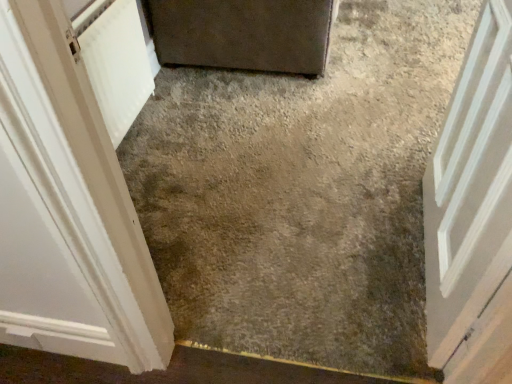
This screenshot has height=384, width=512. Describe the element at coordinates (302, 192) in the screenshot. I see `gray concrete at center` at that location.

Measure the distance between matte gray door at upper center, the 2th door positioned from the right, and camera.

The depth of matte gray door at upper center, the 2th door positioned from the right, is 2.22 meters.

What is the approximate width of white painted wood door at left, the 3th door positioned from the right?

6.00 inches.

What are the coordinates of `gray concrete at center` in the screenshot? It's located at (302, 192).

Between gray concrete at center and matte gray door at upper center, the 2th door positioned from the right, which one has less height?

Standing shorter between the two is gray concrete at center.

Is gray concrete at center inside the boundaries of matte gray door at upper center, the 2th door positioned from the right, or outside?

gray concrete at center lies outside matte gray door at upper center, the 2th door positioned from the right.

Is gray concrete at center far away from matte gray door at upper center, which is the 2th door in left-to-right order?

No, gray concrete at center is in close proximity to matte gray door at upper center, which is the 2th door in left-to-right order.

From the picture: Which of these two, white painted wood door at left, the 3th door positioned from the right, or white painted wood door at center, which ranks as the 1th door in right-to-left order, stands taller?

white painted wood door at center, which ranks as the 1th door in right-to-left order, is taller.

Is white painted wood door at left, the first door in the left-to-right sequence, thinner than white painted wood door at center, which ranks as the 1th door in right-to-left order?

Yes.

Is white painted wood door at center, which ranks as the 1th door in right-to-left order, a part of white painted wood door at left, the 3th door positioned from the right?

No, white painted wood door at left, the 3th door positioned from the right, does not contain white painted wood door at center, which ranks as the 1th door in right-to-left order.

From the image's perspective, which object appears higher, white painted wood door at left, the first door in the left-to-right sequence, or white painted wood door at center, the 3th door when ordered from left to right?

white painted wood door at left, the first door in the left-to-right sequence, from the image's perspective.

Considering the sizes of objects gray concrete at center and white painted wood door at center, which ranks as the 1th door in right-to-left order, in the image provided, who is wider, gray concrete at center or white painted wood door at center, which ranks as the 1th door in right-to-left order,?

Wider between the two is gray concrete at center.

From a real-world perspective, is gray concrete at center positioned over white painted wood door at center, the 3th door when ordered from left to right, based on gravity?

Actually, gray concrete at center is physically below white painted wood door at center, the 3th door when ordered from left to right, in the real world.

Can you tell me how much gray concrete at center and white painted wood door at center, the 3th door when ordered from left to right, differ in facing direction?

gray concrete at center and white painted wood door at center, the 3th door when ordered from left to right, are facing 94.9 degrees away from each other.

Which is in front, gray concrete at center or white painted wood door at center, the 3th door when ordered from left to right?

Positioned in front is white painted wood door at center, the 3th door when ordered from left to right.

From a real-world perspective, is white painted wood door at left, the first door in the left-to-right sequence, located higher than matte gray door at upper center, which is the 2th door in left-to-right order?

Yes.

Is white painted wood door at left, the first door in the left-to-right sequence, facing away from matte gray door at upper center, which is the 2th door in left-to-right order?

No, white painted wood door at left, the first door in the left-to-right sequence, is not facing the opposite direction of matte gray door at upper center, which is the 2th door in left-to-right order.

Is white painted wood door at left, the 3th door positioned from the right, with matte gray door at upper center, which is the 2th door in left-to-right order?

No, white painted wood door at left, the 3th door positioned from the right, is not making contact with matte gray door at upper center, which is the 2th door in left-to-right order.

How different are the orientations of gray concrete at center and white painted wood door at left, the first door in the left-to-right sequence, in degrees?

They differ by 90.7 degrees in their facing directions.

Is gray concrete at center wider or thinner than white painted wood door at left, the 3th door positioned from the right?

gray concrete at center is wider than white painted wood door at left, the 3th door positioned from the right.

Between gray concrete at center and white painted wood door at left, the first door in the left-to-right sequence, which one has larger size?

With larger size is gray concrete at center.

Measure the distance from gray concrete at center to white painted wood door at left, the first door in the left-to-right sequence.

gray concrete at center is 30.66 inches from white painted wood door at left, the first door in the left-to-right sequence.

From a real-world perspective, is white painted wood door at left, the first door in the left-to-right sequence, beneath gray concrete at center?

No, from a real-world perspective, white painted wood door at left, the first door in the left-to-right sequence, is not below gray concrete at center.

Would you say white painted wood door at left, the first door in the left-to-right sequence, contains gray concrete at center?

Definitely not — gray concrete at center is not inside white painted wood door at left, the first door in the left-to-right sequence.

Are white painted wood door at left, the first door in the left-to-right sequence, and gray concrete at center far apart?

white painted wood door at left, the first door in the left-to-right sequence, is near gray concrete at center, not far away.

Locate an element on the screen. The width and height of the screenshot is (512, 384). the 1st door below the gray concrete at center (from the image's perspective) is located at coordinates (68, 208).

Does point (459, 131) come farther from viewer compared to point (96, 126)?

Yes, point (459, 131) is farther from viewer.

Which of these two, white painted wood door at center, the 3th door when ordered from left to right, or white painted wood door at left, the first door in the left-to-right sequence, is thinner?

white painted wood door at left, the first door in the left-to-right sequence, is thinner.

Is white painted wood door at center, which ranks as the 1th door in right-to-left order, in front of or behind white painted wood door at left, the 3th door positioned from the right, in the image?

Clearly, white painted wood door at center, which ranks as the 1th door in right-to-left order, is in front of white painted wood door at left, the 3th door positioned from the right.

Which is correct: white painted wood door at center, which ranks as the 1th door in right-to-left order, is inside white painted wood door at left, the first door in the left-to-right sequence, or outside of it?

white painted wood door at center, which ranks as the 1th door in right-to-left order, is not enclosed by white painted wood door at left, the first door in the left-to-right sequence.

Find the location of a particular element. The height and width of the screenshot is (384, 512). the 1st door to the left when counting from the gray concrete at center is located at coordinates (243, 34).

You are a GUI agent. You are given a task and a screenshot of the screen. Output one action in this format:
    pyautogui.click(x=<x>, y=<y>)
    Task: Click on the 1st door behind the white painted wood door at center, the 3th door when ordered from left to right, starting your count from the anchor
    The height and width of the screenshot is (384, 512).
    Given the screenshot: What is the action you would take?
    pyautogui.click(x=68, y=208)

Which object lies further to the anchor point white painted wood door at left, the first door in the left-to-right sequence, gray concrete at center or white painted wood door at center, the 3th door when ordered from left to right?

Based on the image, white painted wood door at center, the 3th door when ordered from left to right, appears to be further to white painted wood door at left, the first door in the left-to-right sequence.

Estimate the real-world distances between objects in this image. Which object is closer to white painted wood door at left, the 3th door positioned from the right, matte gray door at upper center, the 2th door positioned from the right, or white painted wood door at center, which ranks as the 1th door in right-to-left order?

The object closer to white painted wood door at left, the 3th door positioned from the right, is white painted wood door at center, which ranks as the 1th door in right-to-left order.

From the image, which object appears to be farther from gray concrete at center, white painted wood door at left, the 3th door positioned from the right, or white painted wood door at center, which ranks as the 1th door in right-to-left order?

white painted wood door at left, the 3th door positioned from the right, lies further to gray concrete at center than the other object.

Estimate the real-world distances between objects in this image. Which object is closer to gray concrete at center, white painted wood door at left, the first door in the left-to-right sequence, or matte gray door at upper center, which is the 2th door in left-to-right order?

Based on the image, matte gray door at upper center, which is the 2th door in left-to-right order, appears to be nearer to gray concrete at center.

From the picture: When comparing their distances from matte gray door at upper center, which is the 2th door in left-to-right order, does white painted wood door at center, the 3th door when ordered from left to right, or white painted wood door at left, the 3th door positioned from the right, seem further?

white painted wood door at left, the 3th door positioned from the right, is positioned further to the anchor matte gray door at upper center, which is the 2th door in left-to-right order.

Based on their spatial positions, is matte gray door at upper center, the 2th door positioned from the right, or white painted wood door at left, the first door in the left-to-right sequence, closer to gray concrete at center?

Based on the image, matte gray door at upper center, the 2th door positioned from the right, appears to be nearer to gray concrete at center.

Looking at the image, which one is located closer to white painted wood door at left, the first door in the left-to-right sequence, white painted wood door at center, which ranks as the 1th door in right-to-left order, or gray concrete at center?

gray concrete at center lies closer to white painted wood door at left, the first door in the left-to-right sequence, than the other object.

When comparing their distances from gray concrete at center, does white painted wood door at center, which ranks as the 1th door in right-to-left order, or matte gray door at upper center, the 2th door positioned from the right, seem further?

white painted wood door at center, which ranks as the 1th door in right-to-left order.

Where is `concrete between white painted wood door at center, the 3th door when ordered from left to right, and matte gray door at upper center, the 2th door positioned from the right, from front to back`? concrete between white painted wood door at center, the 3th door when ordered from left to right, and matte gray door at upper center, the 2th door positioned from the right, from front to back is located at coordinates (302, 192).

You are a GUI agent. You are given a task and a screenshot of the screen. Output one action in this format:
    pyautogui.click(x=<x>, y=<y>)
    Task: Click on the concrete situated between white painted wood door at left, the 3th door positioned from the right, and white painted wood door at center, the 3th door when ordered from left to right, from left to right
    
    Given the screenshot: What is the action you would take?
    pyautogui.click(x=302, y=192)

At what (x,y) coordinates should I click in order to perform the action: click on door located between white painted wood door at center, the 3th door when ordered from left to right, and matte gray door at upper center, the 2th door positioned from the right, in the depth direction. Please return your answer as a coordinate pair (x, y). Image resolution: width=512 pixels, height=384 pixels. Looking at the image, I should click on (68, 208).

Locate an element on the screen. door between white painted wood door at left, the 3th door positioned from the right, and gray concrete at center, in the horizontal direction is located at coordinates (243, 34).